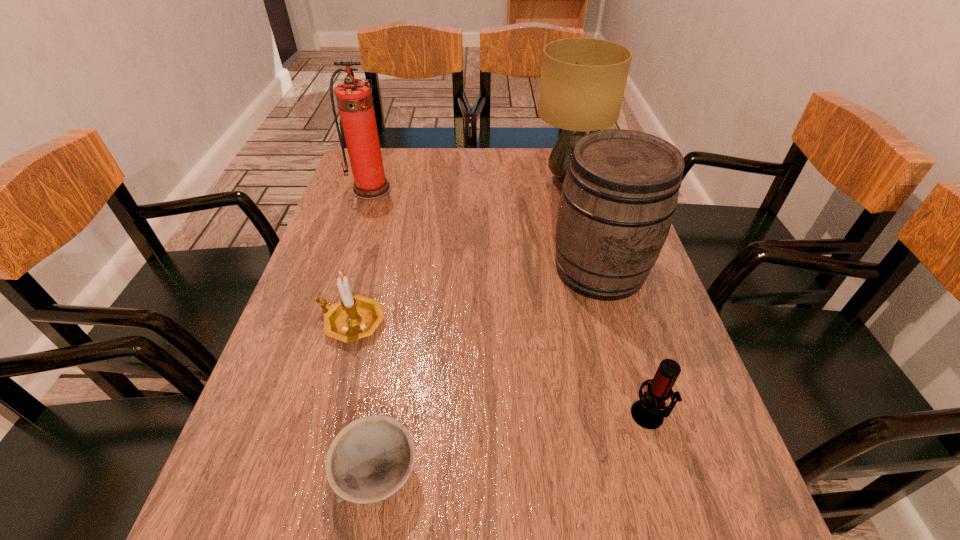
Identify the location of object located in the far left corner section of the desktop. (354, 99).

You are a GUI agent. You are given a task and a screenshot of the screen. Output one action in this format:
    pyautogui.click(x=<x>, y=<y>)
    Task: Click on the object that is at the far right corner
    The height and width of the screenshot is (540, 960).
    Given the screenshot: What is the action you would take?
    pyautogui.click(x=583, y=80)

The image size is (960, 540). What are the coordinates of `vacant space at the far edge of the desktop` in the screenshot? It's located at (464, 152).

You are a GUI agent. You are given a task and a screenshot of the screen. Output one action in this format:
    pyautogui.click(x=<x>, y=<y>)
    Task: Click on the vacant space at the near edge
    The width and height of the screenshot is (960, 540).
    Given the screenshot: What is the action you would take?
    pyautogui.click(x=605, y=529)

I want to click on free space at the left edge, so pyautogui.click(x=310, y=464).

I want to click on free space at the right edge of the desktop, so click(684, 420).

Where is `blank space at the far left corner of the desktop`? The width and height of the screenshot is (960, 540). blank space at the far left corner of the desktop is located at coordinates (351, 178).

Where is `unoccupied position between the fire extinguisher and the candle holder`? unoccupied position between the fire extinguisher and the candle holder is located at coordinates (362, 256).

This screenshot has width=960, height=540. Identify the location of vacant space that's between the candle holder and the fire extinguisher. (362, 256).

Where is `free area in between the bowl and the lampshade`? The image size is (960, 540). free area in between the bowl and the lampshade is located at coordinates (472, 327).